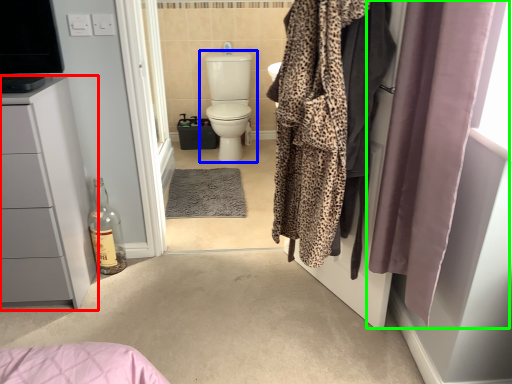
Question: Estimate the real-world distances between objects in this image. Which object is farther from bathroom cabinet (highlighted by a red box), toilet (highlighted by a blue box) or curtain (highlighted by a green box)?

Choices:
 (A) toilet
 (B) curtain

Answer: (A)